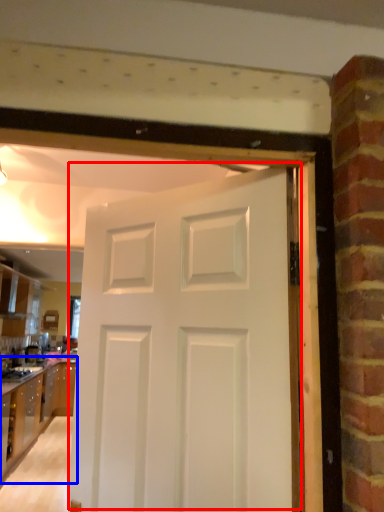
Question: Which point is further to the camera, door (highlighted by a red box) or cabinetry (highlighted by a blue box)?

Choices:
 (A) door
 (B) cabinetry

Answer: (B)